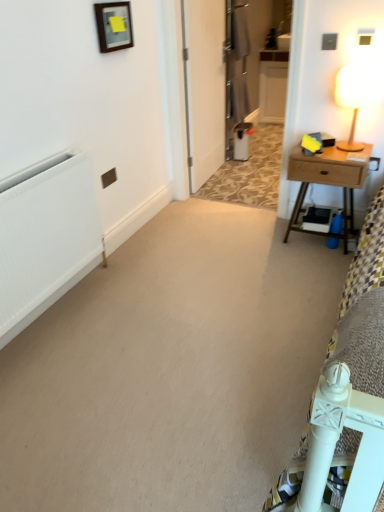
Question: Does wooden nightstand at right have a greater width compared to wooden frame at upper center?

Choices:
 (A) yes
 (B) no

Answer: (A)

Question: From a real-world perspective, is wooden nightstand at right located beneath wooden frame at upper center?

Choices:
 (A) yes
 (B) no

Answer: (A)

Question: Is wooden frame at upper center located within wooden nightstand at right?

Choices:
 (A) yes
 (B) no

Answer: (B)

Question: Considering the relative positions of wooden nightstand at right and wooden frame at upper center in the image provided, is wooden nightstand at right to the right of wooden frame at upper center from the viewer's perspective?

Choices:
 (A) no
 (B) yes

Answer: (B)

Question: From the image's perspective, would you say wooden nightstand at right is shown under wooden frame at upper center?

Choices:
 (A) yes
 (B) no

Answer: (A)

Question: Based on their sizes in the image, would you say white matte radiator at left is bigger or smaller than wooden frame at upper center?

Choices:
 (A) small
 (B) big

Answer: (B)

Question: Is point (44, 166) closer or farther from the camera than point (130, 23)?

Choices:
 (A) closer
 (B) farther

Answer: (A)

Question: Based on their positions, is white matte radiator at left located to the left or right of wooden frame at upper center?

Choices:
 (A) left
 (B) right

Answer: (A)

Question: In terms of width, does white matte radiator at left look wider or thinner when compared to wooden frame at upper center?

Choices:
 (A) thin
 (B) wide

Answer: (B)

Question: Considering their positions, is wooden table lamp at upper right located in front of or behind wooden frame at upper center?

Choices:
 (A) front
 (B) behind

Answer: (A)

Question: Is wooden table lamp at upper right situated inside wooden frame at upper center or outside?

Choices:
 (A) inside
 (B) outside

Answer: (B)

Question: In terms of width, does wooden table lamp at upper right look wider or thinner when compared to wooden frame at upper center?

Choices:
 (A) wide
 (B) thin

Answer: (A)

Question: Is wooden table lamp at upper right bigger or smaller than wooden frame at upper center?

Choices:
 (A) big
 (B) small

Answer: (A)

Question: Based on their sizes in the image, would you say wooden frame at upper center is bigger or smaller than white matte radiator at left?

Choices:
 (A) small
 (B) big

Answer: (A)

Question: From the image's perspective, is wooden frame at upper center positioned above or below white matte radiator at left?

Choices:
 (A) above
 (B) below

Answer: (A)